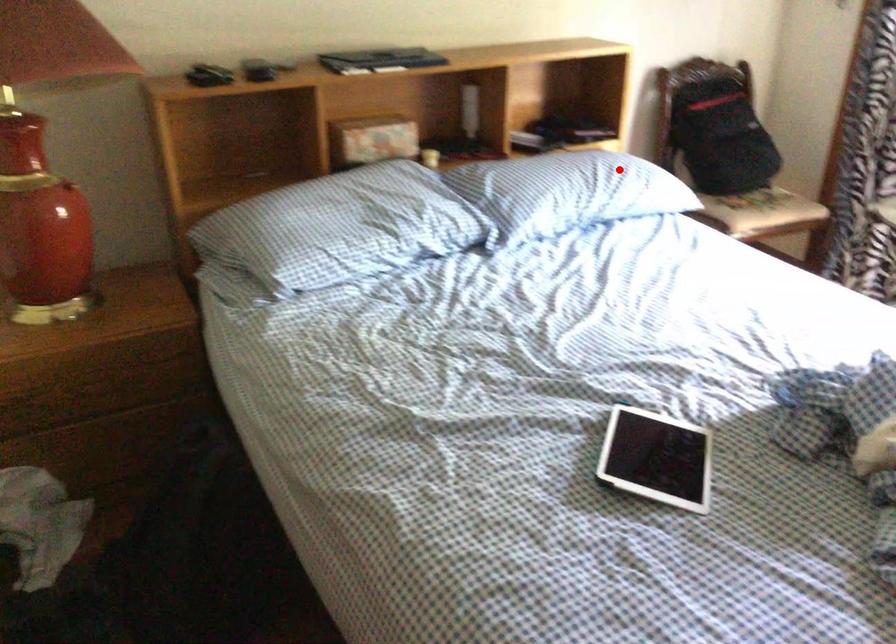
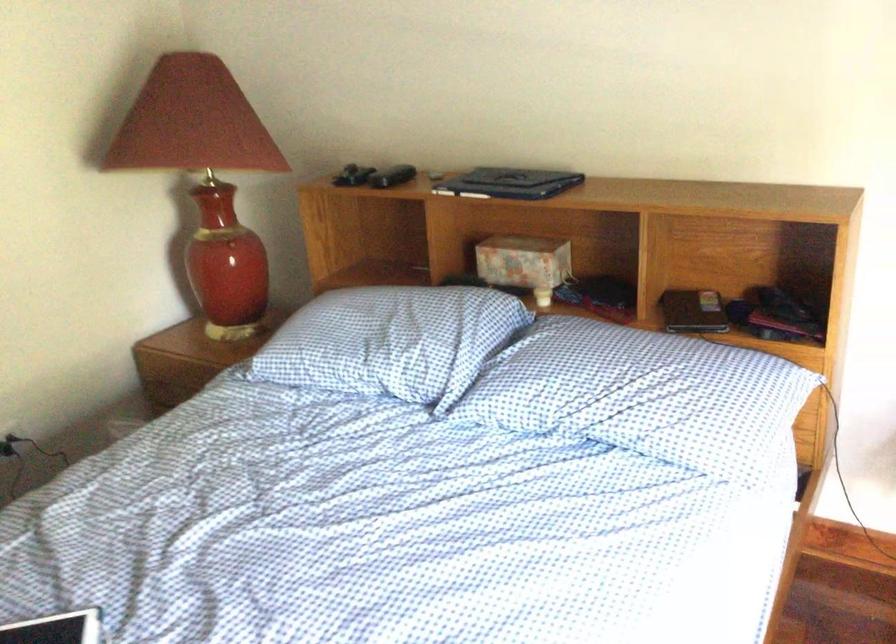
Question: I am providing you with two images of the same scene from different viewpoints. Image1 has a red point marked. In image2, the corresponding 3D location appears at what relative position? Reply with the corresponding letter.

Choices:
 (A) Closer
 (B) Farther

Answer: (A)